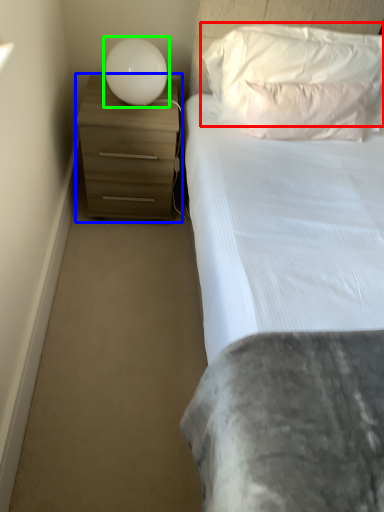
Question: Which object is the closest to the pillow (highlighted by a red box)? Choose among these: chest of drawers (highlighted by a blue box) or lamp (highlighted by a green box).

Choices:
 (A) chest of drawers
 (B) lamp

Answer: (B)